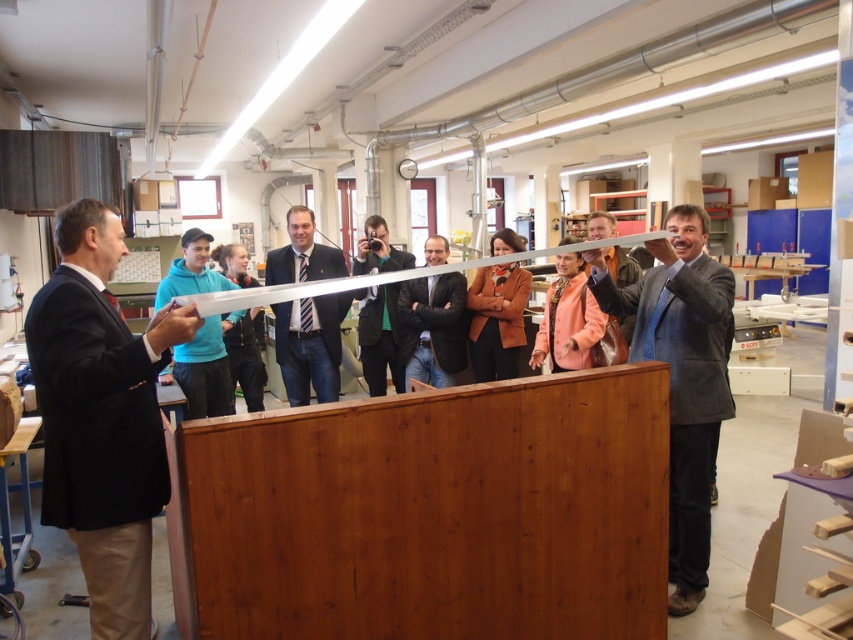
You are standing at the back of the room and want to shake hands with both the black suit at left and the dark brown leather jacket at center. Which person should you approach first to reach them in the shortest path?

You should approach the black suit at left first because they are closer to you than the dark brown leather jacket at center, so reaching them requires a shorter path.

In the ribbon cutting ceremony scene, there are two people wearing gray suit at right and teal fabric jacket at center. Which one is positioned to the right side of the other?

The gray suit at right is positioned to the right of the teal fabric jacket at center.